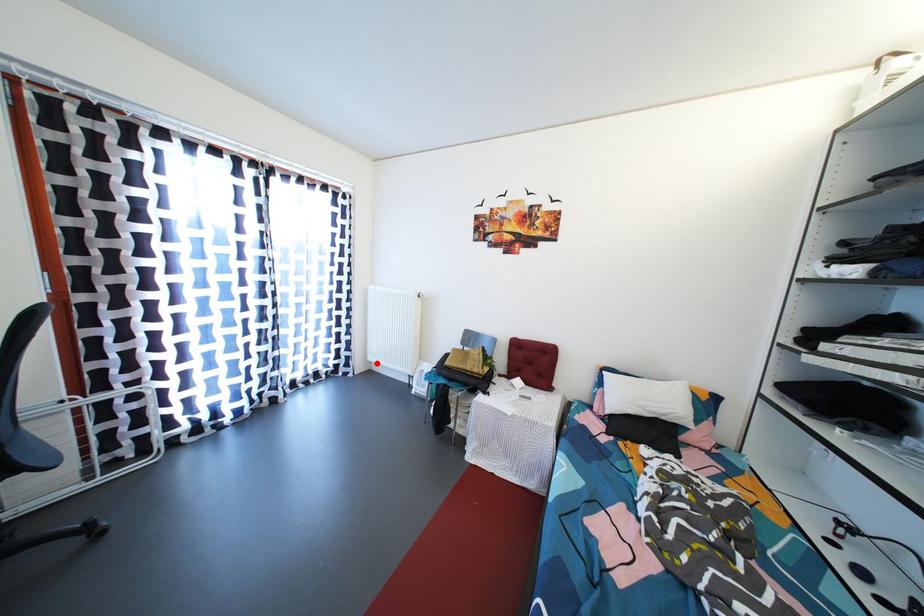
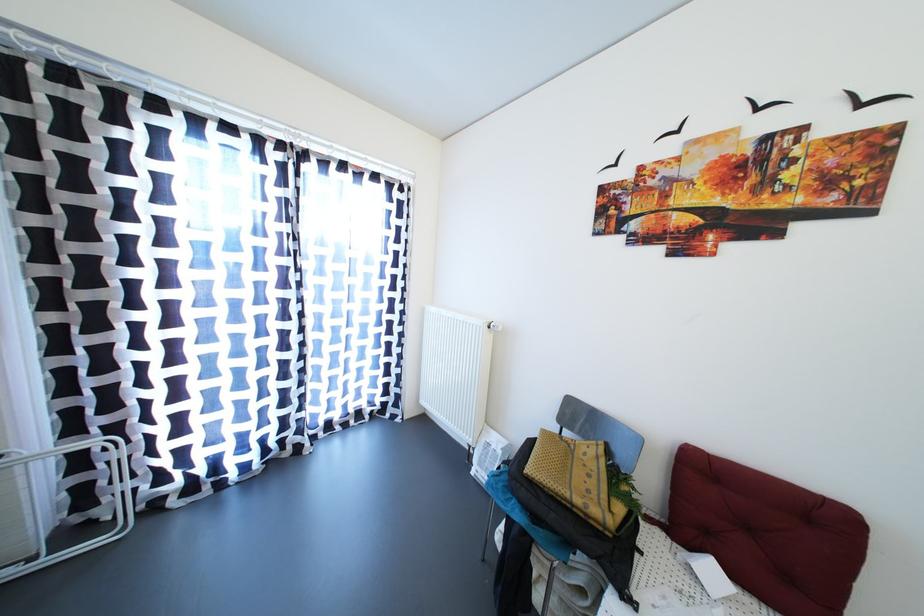
In the second image, find the point that corresponds to the highlighted location in the first image.

(430, 407)